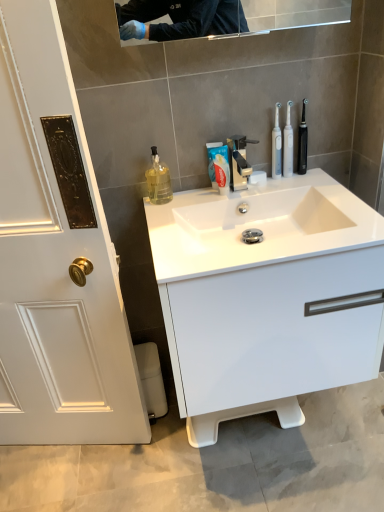
Question: From the image's perspective, relative to white glossy sink at center, is polished chrome faucet at center above or below?

Choices:
 (A) below
 (B) above

Answer: (B)

Question: Is polished chrome faucet at center to the left or to the right of white glossy sink at center in the image?

Choices:
 (A) right
 (B) left

Answer: (B)

Question: Which object is positioned closest to the white glossy sink at center?

Choices:
 (A) white plastic toothbrush at upper right, which appears as the first toothbrush when viewed from the left
 (B) white glossy cabinet at center
 (C) polished chrome faucet at center
 (D) black plastic toothbrush at right, which appears as the 1th toothbrush when viewed from the right
 (E) white glossy toothpaste at center

Answer: (B)

Question: Which is nearer to the translucent plastic mouthwash at center, the 1th mouthwash when ordered from right to left?

Choices:
 (A) black plastic toothbrush at right, which appears as the 1th toothbrush when viewed from the right
 (B) white glossy sink at center
 (C) white glossy toothpaste at center
 (D) white plastic toothbrush at upper right, placed as the second toothbrush when sorted from right to left
 (E) translucent glass mouthwash at left, the 1th mouthwash positioned from the left

Answer: (D)